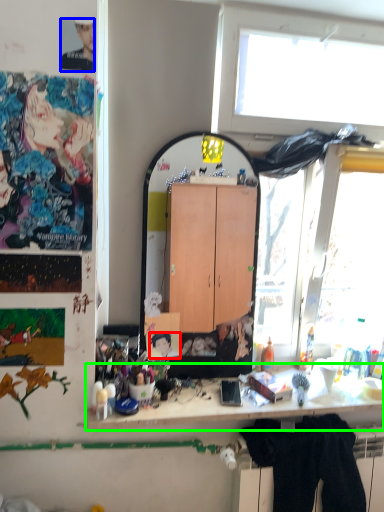
Question: Considering the real-world distances, which object is closest to person (highlighted by a red box)? person (highlighted by a blue box) or desk (highlighted by a green box).

Choices:
 (A) person
 (B) desk

Answer: (B)